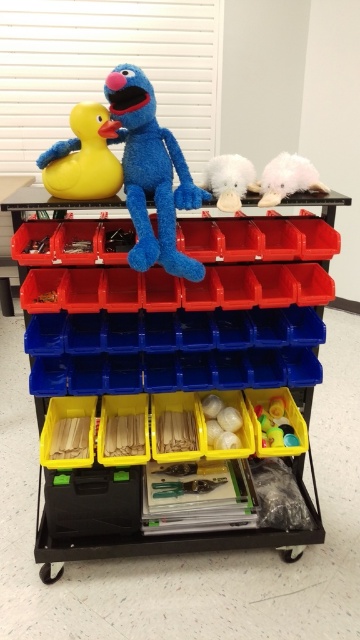
Question: Can you confirm if blue plush toy at center is positioned to the right of yellow rubber duck at upper left?

Choices:
 (A) no
 (B) yes

Answer: (B)

Question: Is yellow rubber duck at upper left bigger than white fluffy toy at upper right?

Choices:
 (A) no
 (B) yes

Answer: (B)

Question: Which object appears farthest from the camera in this image?

Choices:
 (A) blue plush toy at center
 (B) yellow rubber duck at upper left

Answer: (B)

Question: Which point is farther from the camera taking this photo?

Choices:
 (A) (87, 109)
 (B) (146, 244)

Answer: (A)

Question: Estimate the real-world distances between objects in this image. Which object is farther from the white fluffy toy at upper right?

Choices:
 (A) fluffy white cloud at upper right
 (B) blue plush toy at center
 (C) yellow rubber duck at upper left

Answer: (C)

Question: Does blue plush toy at center have a smaller size compared to yellow rubber duck at upper left?

Choices:
 (A) no
 (B) yes

Answer: (A)